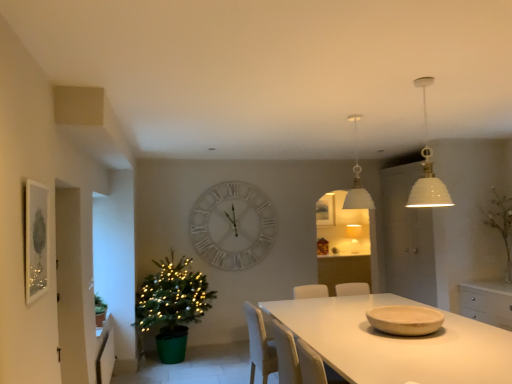
Question: Is white matte table at center taller than white matte clock at center?

Choices:
 (A) no
 (B) yes

Answer: (A)

Question: Are white matte table at center and white matte clock at center far apart?

Choices:
 (A) yes
 (B) no

Answer: (A)

Question: From the image's perspective, is white matte table at center located above white matte clock at center?

Choices:
 (A) no
 (B) yes

Answer: (A)

Question: Can you confirm if white matte table at center is thinner than white matte clock at center?

Choices:
 (A) no
 (B) yes

Answer: (A)

Question: From a real-world perspective, does white matte table at center sit lower than white matte clock at center?

Choices:
 (A) yes
 (B) no

Answer: (A)

Question: Is white matte table at center positioned in front of white matte clock at center?

Choices:
 (A) no
 (B) yes

Answer: (B)

Question: Is white matte pendant light at upper center, acting as the second lamp starting from the front, positioned far away from matte beige bowl at table right?

Choices:
 (A) yes
 (B) no

Answer: (A)

Question: Can you see white matte pendant light at upper center, acting as the first lamp starting from the back, touching matte beige bowl at table right?

Choices:
 (A) yes
 (B) no

Answer: (B)

Question: Considering the relative positions of white matte pendant light at upper center, acting as the second lamp starting from the front, and matte beige bowl at table right in the image provided, is white matte pendant light at upper center, acting as the second lamp starting from the front, to the left of matte beige bowl at table right from the viewer's perspective?

Choices:
 (A) no
 (B) yes

Answer: (B)

Question: From the image's perspective, does white matte pendant light at upper center, acting as the second lamp starting from the front, appear lower than matte beige bowl at table right?

Choices:
 (A) yes
 (B) no

Answer: (B)

Question: Is the position of white matte pendant light at upper center, acting as the second lamp starting from the front, more distant than that of matte beige bowl at table right?

Choices:
 (A) no
 (B) yes

Answer: (B)

Question: Can you confirm if white matte pendant light at upper center, acting as the first lamp starting from the back, is bigger than matte beige bowl at table right?

Choices:
 (A) no
 (B) yes

Answer: (B)

Question: From a real-world perspective, is white matte table at center physically above matte beige bowl at table right?

Choices:
 (A) yes
 (B) no

Answer: (B)